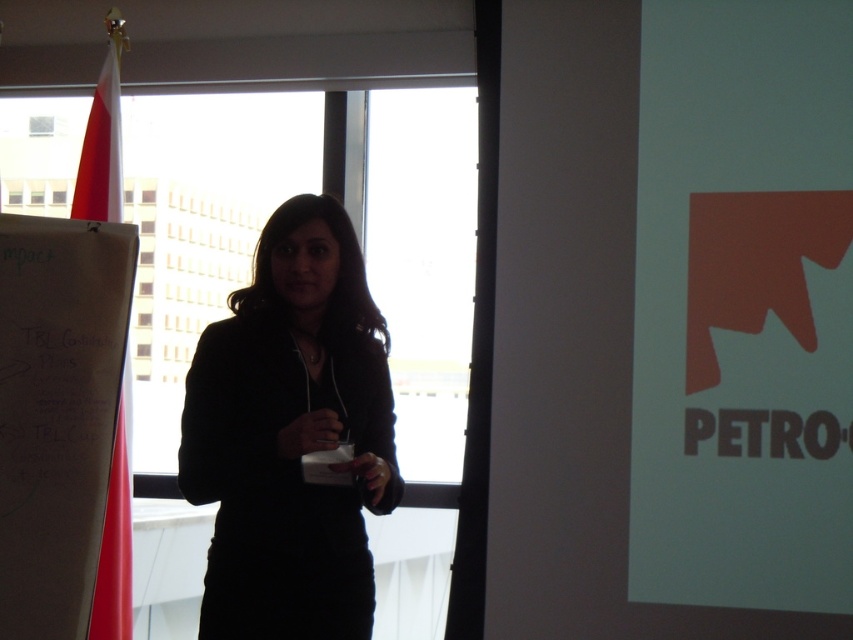
Question: Does black matte dress at center appear over red fabric flag at left?

Choices:
 (A) yes
 (B) no

Answer: (A)

Question: Can you confirm if black matte dress at center is wider than red fabric flag at left?

Choices:
 (A) yes
 (B) no

Answer: (A)

Question: Which of the following is the farthest from the observer?

Choices:
 (A) (79, 188)
 (B) (225, 506)

Answer: (A)

Question: Which object appears farthest from the camera in this image?

Choices:
 (A) red fabric flag at left
 (B) black matte dress at center

Answer: (A)

Question: Which object appears farthest from the camera in this image?

Choices:
 (A) black matte dress at center
 (B) red fabric flag at left

Answer: (B)

Question: Is black matte dress at center to the right of red fabric flag at left from the viewer's perspective?

Choices:
 (A) no
 (B) yes

Answer: (B)